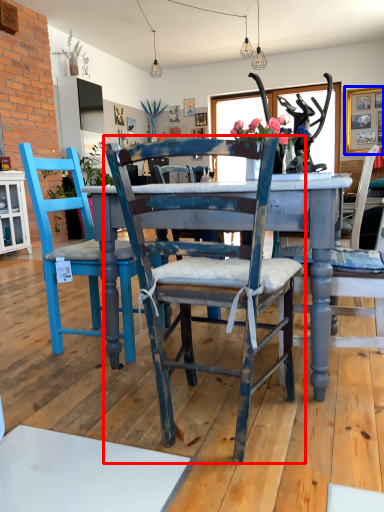
Question: Which object is further to the camera taking this photo, chair (highlighted by a red box) or picture frame (highlighted by a blue box)?

Choices:
 (A) chair
 (B) picture frame

Answer: (B)